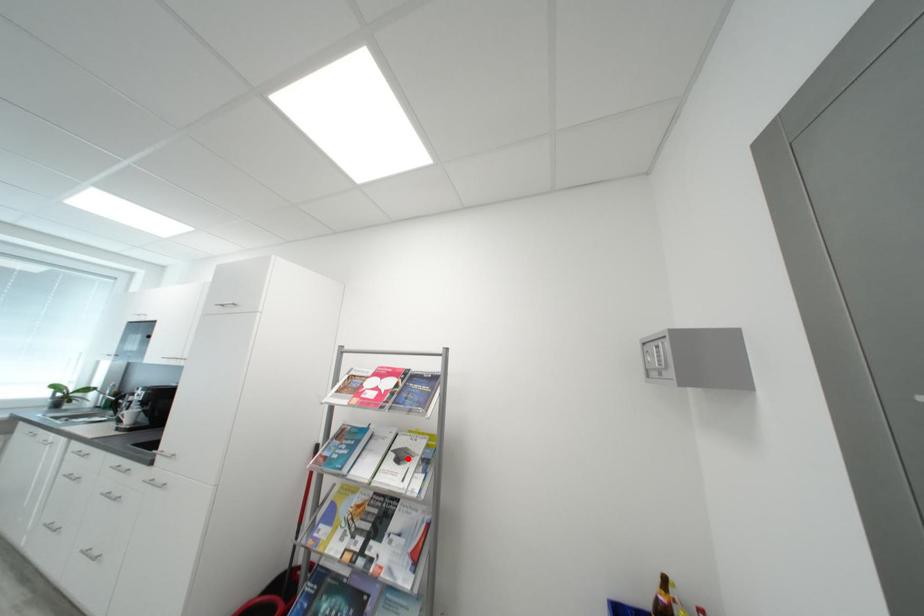
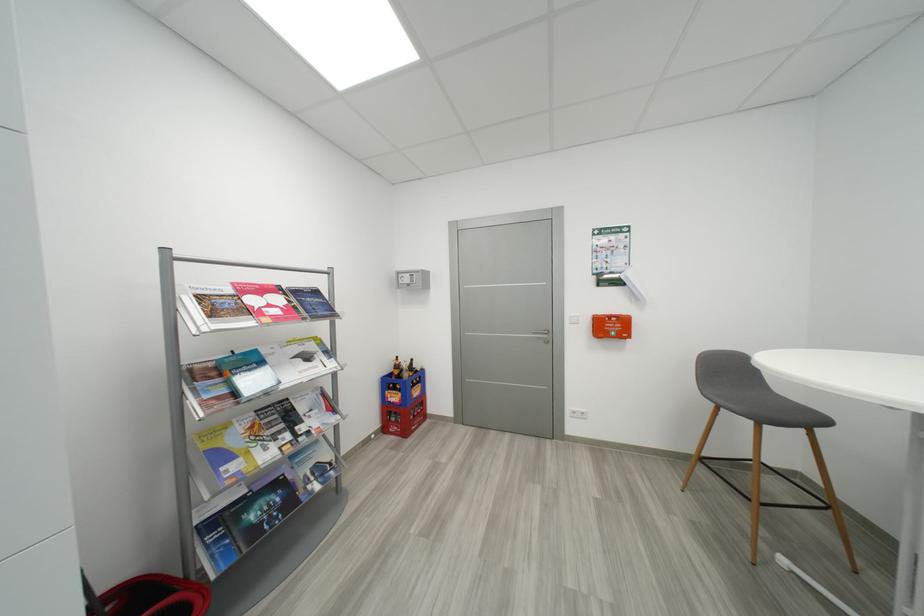
The point at the highlighted location is marked in the first image. Where is the corresponding point in the second image?

(314, 359)